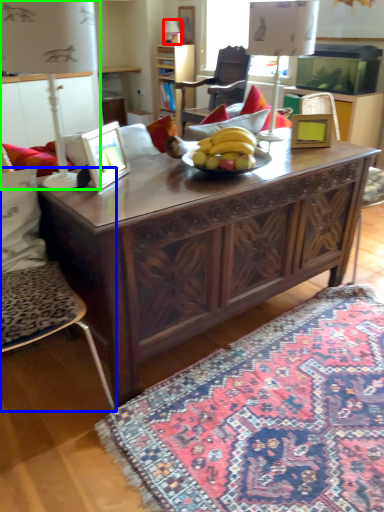
Question: Considering the real-world distances, which object is farthest from lamp (highlighted by a red box)? chair (highlighted by a blue box) or lamp (highlighted by a green box)?

Choices:
 (A) chair
 (B) lamp

Answer: (A)